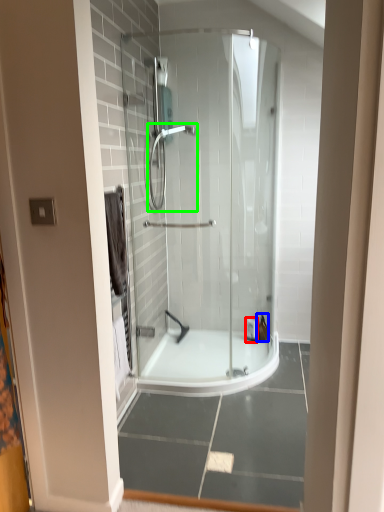
Question: Estimate the real-world distances between objects in this image. Which object is closer to toiletry (highlighted by a red box), toiletry (highlighted by a blue box) or shower (highlighted by a green box)?

Choices:
 (A) toiletry
 (B) shower

Answer: (A)